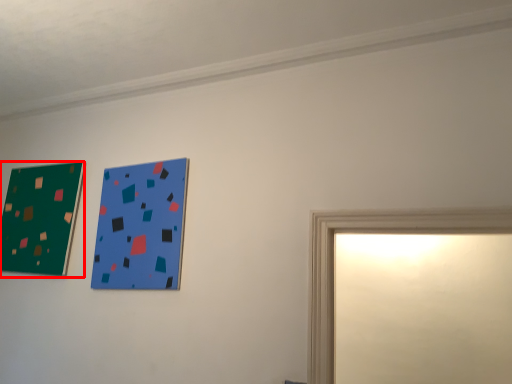
Question: From the image's perspective, considering the relative positions of picture frame (annotated by the red box) and picture frame in the image provided, where is picture frame (annotated by the red box) located with respect to the staircase?

Choices:
 (A) above
 (B) below

Answer: (A)